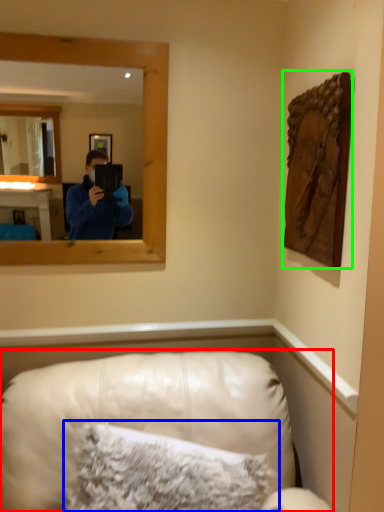
Question: Estimate the real-world distances between objects in this image. Which object is closer to furniture (highlighted by a red box), pillow (highlighted by a blue box) or picture frame (highlighted by a green box)?

Choices:
 (A) pillow
 (B) picture frame

Answer: (A)